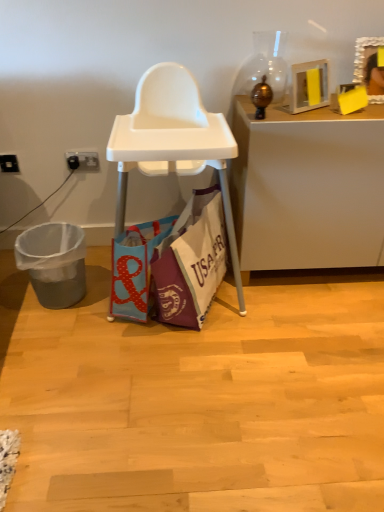
The width and height of the screenshot is (384, 512). What are the coordinates of `unoccupied area in front of purple fabric bag at center, which is counted as the 1th handbag, starting from the right` in the screenshot? It's located at 208,368.